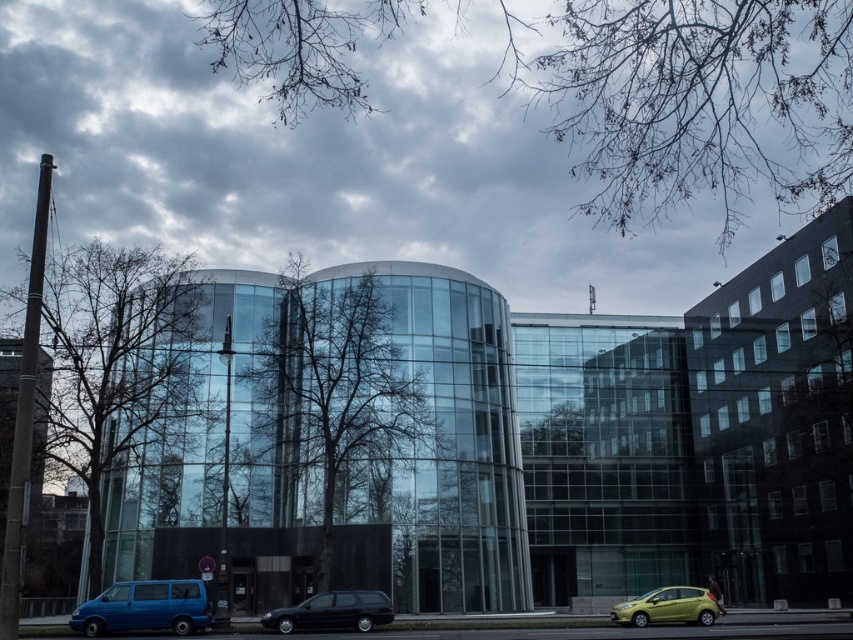
Question: From the image, what is the correct spatial relationship of shiny black station wagon at lower center in relation to metallic yellow car at lower right?

Choices:
 (A) left
 (B) right

Answer: (A)

Question: Which object is closer to the camera taking this photo?

Choices:
 (A) metallic yellow car at lower right
 (B) blue matte van at lower left

Answer: (B)

Question: Which of these objects is positioned closest to the shiny black station wagon at lower center?

Choices:
 (A) blue matte van at lower left
 (B) metallic yellow car at lower right

Answer: (A)

Question: Can you confirm if blue matte van at lower left is positioned to the left of shiny black station wagon at lower center?

Choices:
 (A) no
 (B) yes

Answer: (B)

Question: Which object is the closest to the blue matte van at lower left?

Choices:
 (A) shiny black station wagon at lower center
 (B) metallic yellow car at lower right

Answer: (A)

Question: Considering the relative positions of blue matte van at lower left and shiny black station wagon at lower center in the image provided, where is blue matte van at lower left located with respect to shiny black station wagon at lower center?

Choices:
 (A) left
 (B) right

Answer: (A)